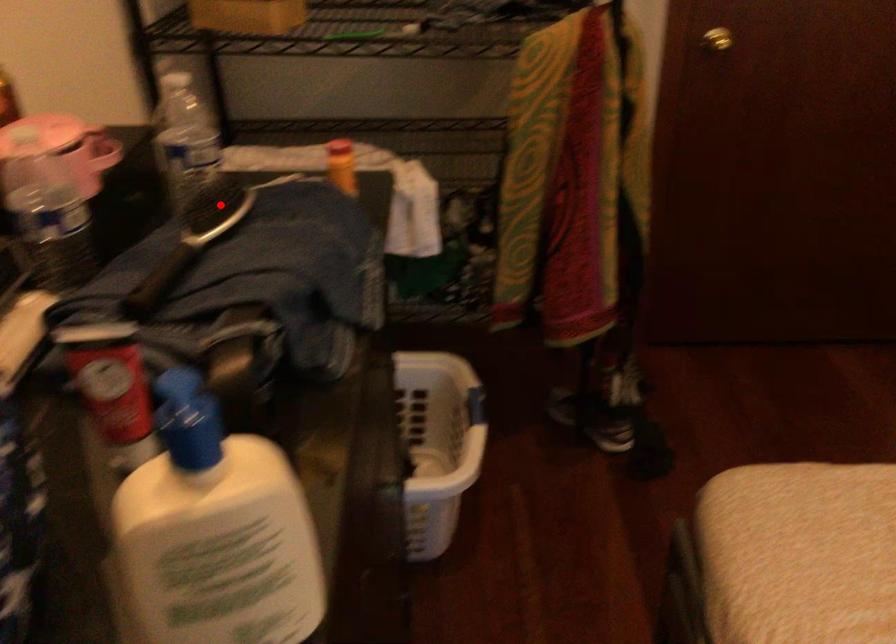
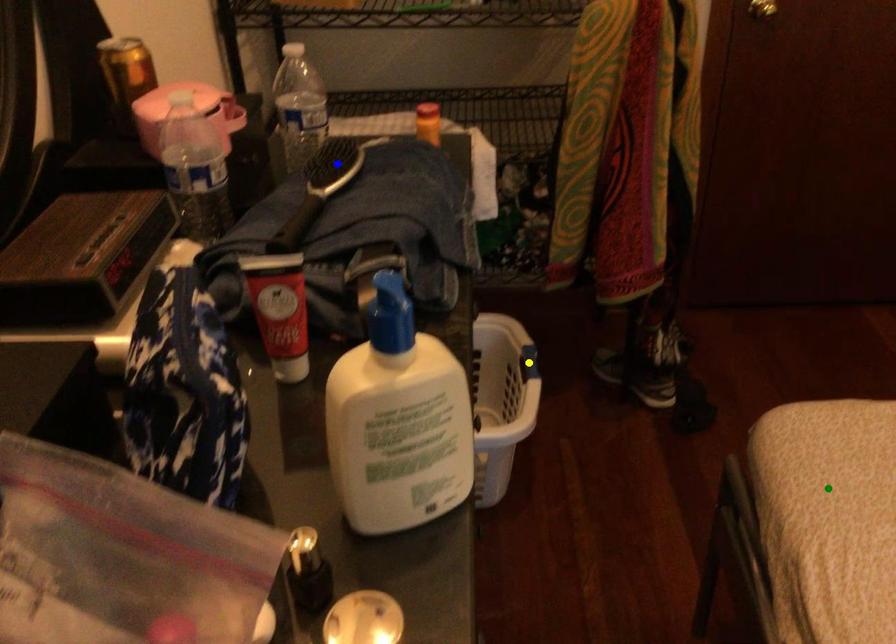
Question: I am providing you with two images of the same scene from different viewpoints. A red point is marked on the first image. You are given multiple points on the second image. Which spot in image 2 lines up with the point in image 1?

Choices:
 (A) green point
 (B) yellow point
 (C) blue point

Answer: (C)